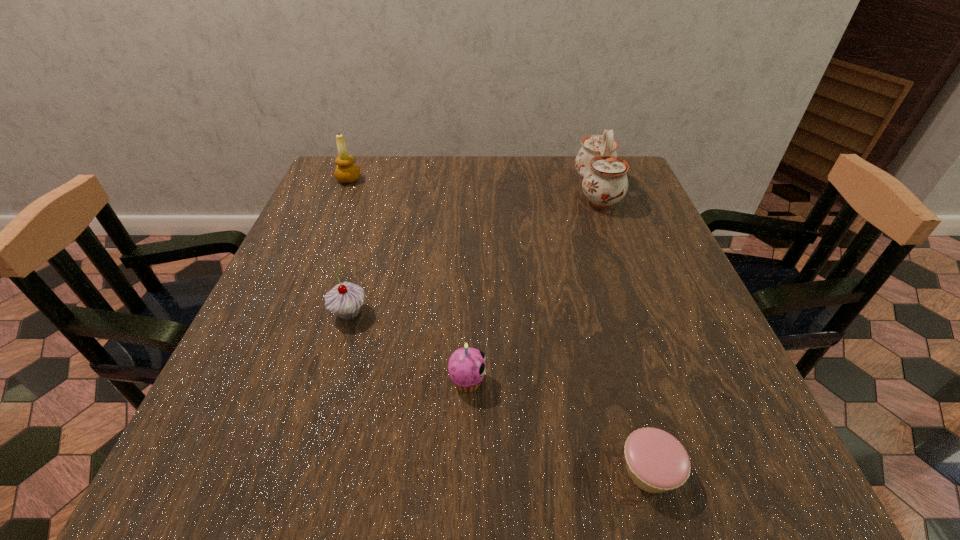
At what (x,y) coordinates should I click in order to perform the action: click on vacant point at the near right corner. Please return your answer as a coordinate pair (x, y). Image resolution: width=960 pixels, height=540 pixels. Looking at the image, I should click on (718, 481).

Find the location of `vacant point located between the second farthest cupcake and the leftmost cupcake`. vacant point located between the second farthest cupcake and the leftmost cupcake is located at coordinates (408, 347).

The image size is (960, 540). Identify the location of free spot between the third farthest object and the nearest cupcake. (499, 392).

Locate an element on the screen. The width and height of the screenshot is (960, 540). vacant space in between the second object from left to right and the shortest object is located at coordinates [499, 392].

Locate an element on the screen. The image size is (960, 540). vacant space that is in between the farthest cupcake and the nearest cupcake is located at coordinates (499, 392).

I want to click on vacant space that is in between the shortest cupcake and the leftmost cupcake, so click(499, 392).

Where is `free point between the second cupcake from right to left and the second object from left to right`? The height and width of the screenshot is (540, 960). free point between the second cupcake from right to left and the second object from left to right is located at coordinates click(x=408, y=347).

Where is `vacant space that is in between the rightmost cupcake and the second nearest object`? This screenshot has height=540, width=960. vacant space that is in between the rightmost cupcake and the second nearest object is located at coordinates (559, 426).

Image resolution: width=960 pixels, height=540 pixels. I want to click on blank region between the second cupcake from right to left and the candle_holder, so click(x=408, y=280).

Locate an element on the screen. This screenshot has width=960, height=540. free area in between the nearest object and the second nearest cupcake is located at coordinates (559, 426).